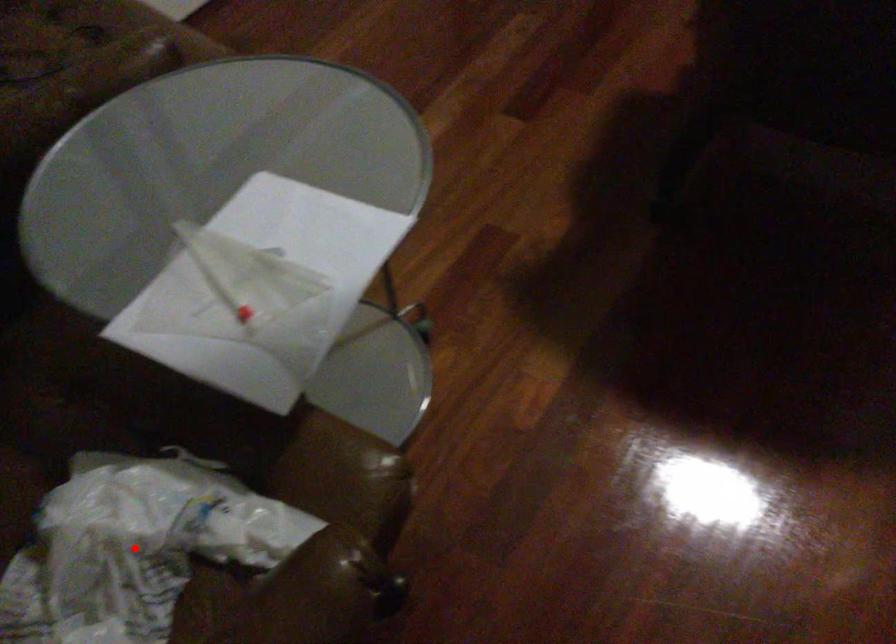
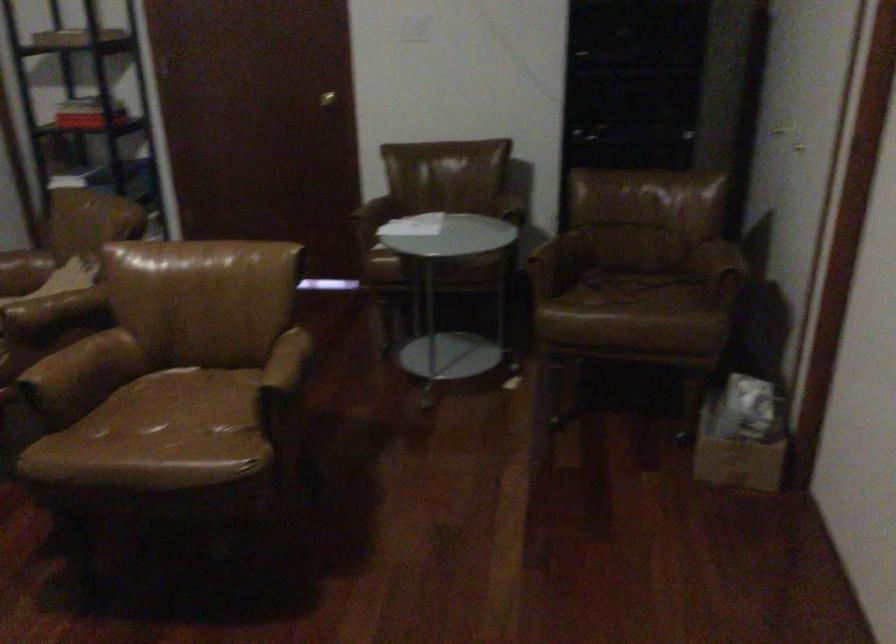
Question: I am providing you with two images of the same scene from different viewpoints. A red point is marked on the first image. At the location where the point appears in image 1, is it still visible in image 2?

Choices:
 (A) Yes
 (B) No

Answer: (B)